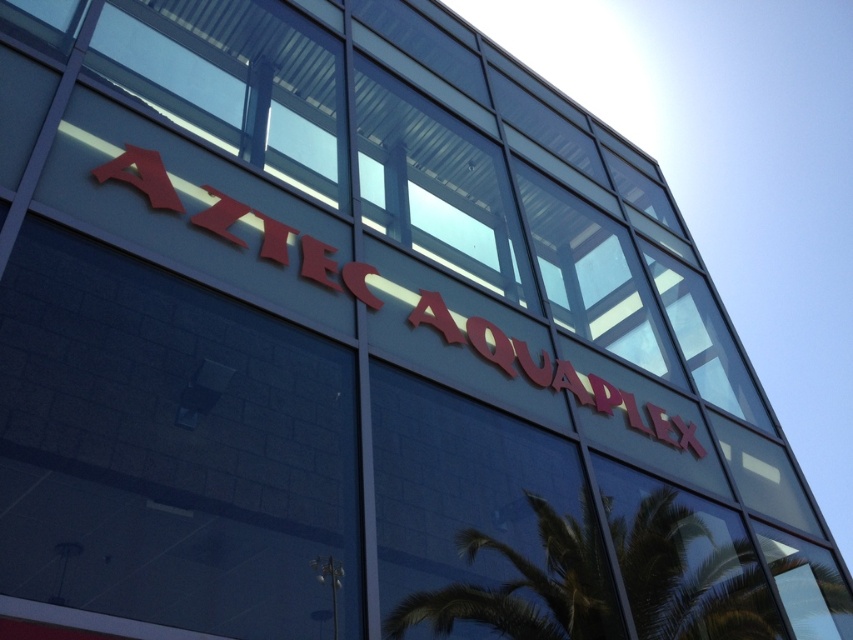
From the picture: You are a photographer trying to capture the red glossy sign at upper center in your shot. You notice a green leafy palm tree at lower right might block part of the sign. Based on their sizes, will the palm tree at lower right cover more or less of the sign than the sign covers of itself?

The green leafy palm tree at lower right has a lesser width compared to the red glossy sign at upper center. Therefore, the palm tree at lower right will cover less of the sign than the sign covers of itself.

You are standing in front of the Aztec Aquaplex building and notice a green leafy palm tree at lower right. Based on its position, can you determine if it is closer to the building or further away from it?

The green leafy palm tree at lower right is located at point 0.808 on the vertical axis, which places it closer to the bottom of the image. Since the building is the main subject at the center, the palm tree is likely positioned further away from the building, as it is situated lower in the frame.